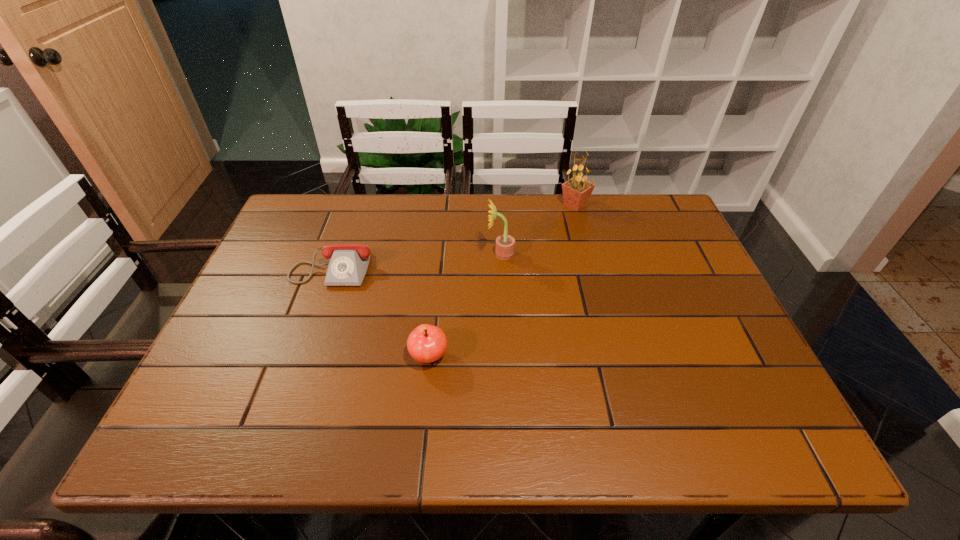
Where is `free spot between the second object from right to left and the farther sunflower`? Image resolution: width=960 pixels, height=540 pixels. free spot between the second object from right to left and the farther sunflower is located at coordinates (538, 230).

The height and width of the screenshot is (540, 960). Identify the location of empty location between the farther sunflower and the nearest object. (502, 281).

This screenshot has height=540, width=960. What are the coordinates of `free space between the telephone and the rightmost object` in the screenshot? It's located at (454, 234).

Find the location of `vacant space in between the farthest object and the apple`. vacant space in between the farthest object and the apple is located at coordinates (502, 281).

Where is `vacant region between the leftmost object and the third object from left to right`? The height and width of the screenshot is (540, 960). vacant region between the leftmost object and the third object from left to right is located at coordinates (417, 259).

Locate which object ranks in proximity to the farther sunflower. Please provide its 2D coordinates. Your answer should be formatted as a tuple, i.e. [(x, y)], where the tuple contains the x and y coordinates of a point satisfying the conditions above.

[(505, 244)]

Identify which object is located as the second nearest to the left sunflower. Please provide its 2D coordinates. Your answer should be formatted as a tuple, i.e. [(x, y)], where the tuple contains the x and y coordinates of a point satisfying the conditions above.

[(427, 343)]

Where is `free space that satisfies the following two spatial constraints: 1. at the front of the farthest object with flowers visible; 2. on the dial of the telephone`? Image resolution: width=960 pixels, height=540 pixels. free space that satisfies the following two spatial constraints: 1. at the front of the farthest object with flowers visible; 2. on the dial of the telephone is located at coordinates (591, 264).

Where is `blank space that satisfies the following two spatial constraints: 1. at the front of the farther sunflower with flowers visible; 2. on the front side of the third object from right to left`? The image size is (960, 540). blank space that satisfies the following two spatial constraints: 1. at the front of the farther sunflower with flowers visible; 2. on the front side of the third object from right to left is located at coordinates (615, 357).

This screenshot has width=960, height=540. I want to click on free spot that satisfies the following two spatial constraints: 1. at the front of the rightmost object with flowers visible; 2. on the dial of the shortest object, so click(591, 264).